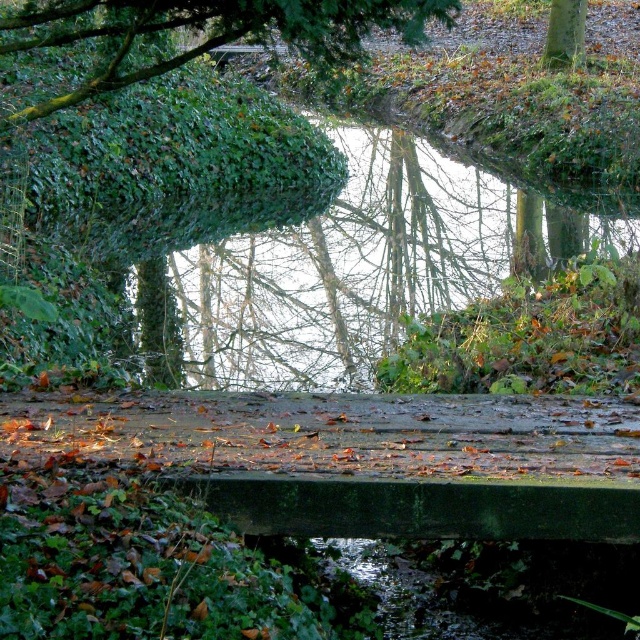
Question: Which object is farther from the camera taking this photo?

Choices:
 (A) green leafy tree at upper center
 (B) green leafy stream at center
 (C) green rough bark tree at upper right

Answer: (C)

Question: Does green leafy stream at center have a lesser width compared to green rough bark tree at upper right?

Choices:
 (A) yes
 (B) no

Answer: (B)

Question: Does green leafy stream at center have a greater width compared to green leafy tree at upper left?

Choices:
 (A) yes
 (B) no

Answer: (A)

Question: Which point is farther to the camera?

Choices:
 (A) (113, 52)
 (B) (132, 17)

Answer: (A)

Question: Which object is farther from the camera taking this photo?

Choices:
 (A) green leafy tree at upper left
 (B) green leafy tree at upper center
 (C) green rough bark tree at upper right
 (D) green leafy stream at center

Answer: (C)

Question: Is green leafy stream at center wider than green rough bark tree at upper right?

Choices:
 (A) no
 (B) yes

Answer: (B)